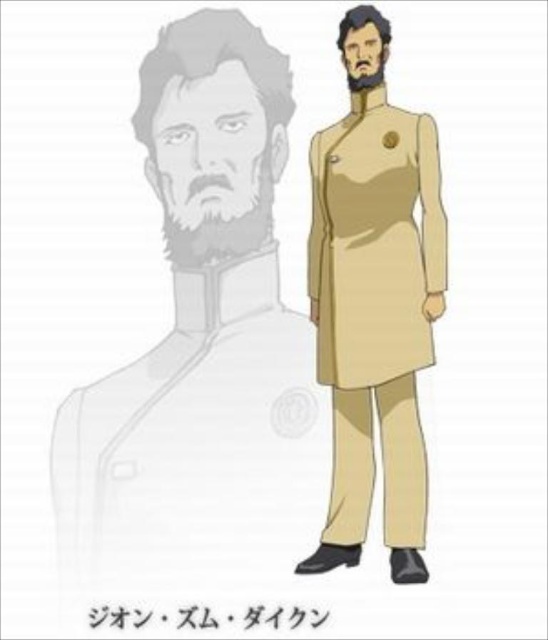
Question: Among these points, which one is nearest to the camera?

Choices:
 (A) (167, 48)
 (B) (328, 352)

Answer: (A)

Question: Is beige fabric coat at center thinner than beige matte trench coat at center?

Choices:
 (A) yes
 (B) no

Answer: (B)

Question: Is beige fabric coat at center closer to camera compared to beige matte trench coat at center?

Choices:
 (A) no
 (B) yes

Answer: (B)

Question: Does beige fabric coat at center appear on the left side of beige matte trench coat at center?

Choices:
 (A) no
 (B) yes

Answer: (B)

Question: Which point appears closest to the camera in this image?

Choices:
 (A) (301, 422)
 (B) (395, 528)

Answer: (A)

Question: Which object appears farthest from the camera in this image?

Choices:
 (A) beige matte trench coat at center
 (B) beige fabric coat at center

Answer: (A)